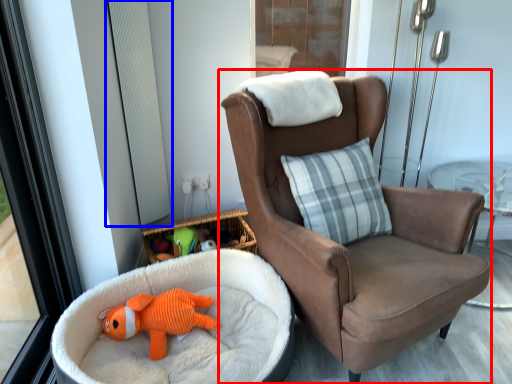
Question: Which object appears farthest to the camera in this image, chair (highlighted by a red box) or window screen (highlighted by a blue box)?

Choices:
 (A) chair
 (B) window screen

Answer: (B)